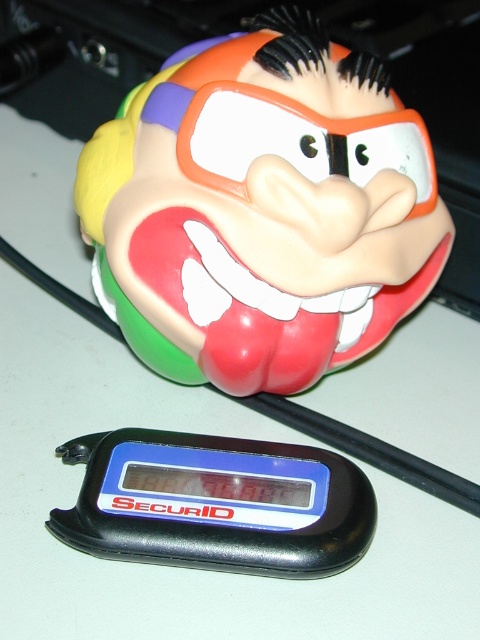
You are a painter standing 1 meter away from a canvas. You want to paint the rubber clown head at upper center which is 1.16 meters away from you. Can you reach it with your paintbrush?

The rubber clown head at upper center is 1.16 meters away from you, which is beyond your current reach of 1 meter. You need to move closer or use a longer tool to reach it.

You are organizing items on a desk and need to know which object is taller between the rubber clown head at upper center and the black plastic securid at bottom. Can you tell me which one is taller?

The rubber clown head at upper center is taller than the black plastic securid at bottom according to the description.

You are organizing items on a desk and need to place a new item between the rubber clown head at upper center and the black plastic securid at bottom. Can you fit it there?

The black plastic securid at bottom is behind the rubber clown head at upper center, so there is no space between them for the new item to be placed.